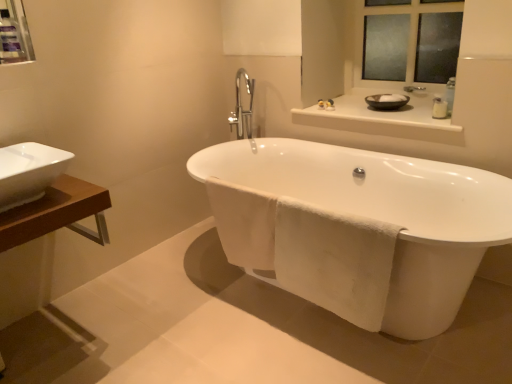
Question: Is white ceramic sink at left situated inside white glossy counter top at upper center or outside?

Choices:
 (A) outside
 (B) inside

Answer: (A)

Question: From a real-world perspective, is white ceramic sink at left positioned above or below white glossy counter top at upper center?

Choices:
 (A) below
 (B) above

Answer: (B)

Question: Estimate the real-world distances between objects in this image. Which object is farther from the white glossy counter top at upper center?

Choices:
 (A) white ceramic sink at left
 (B) black ceramic basin at upper right
 (C) glossy ceramic mirror at upper center
 (D) white glossy bathtub at center
 (E) matte plastic medicine cabinet at upper left

Answer: (E)

Question: Which object is positioned farthest from the white plastic bottle at upper right?

Choices:
 (A) white glossy bathtub at center
 (B) white ceramic sink at left
 (C) glossy ceramic mirror at upper center
 (D) matte plastic medicine cabinet at upper left
 (E) black ceramic basin at upper right

Answer: (D)